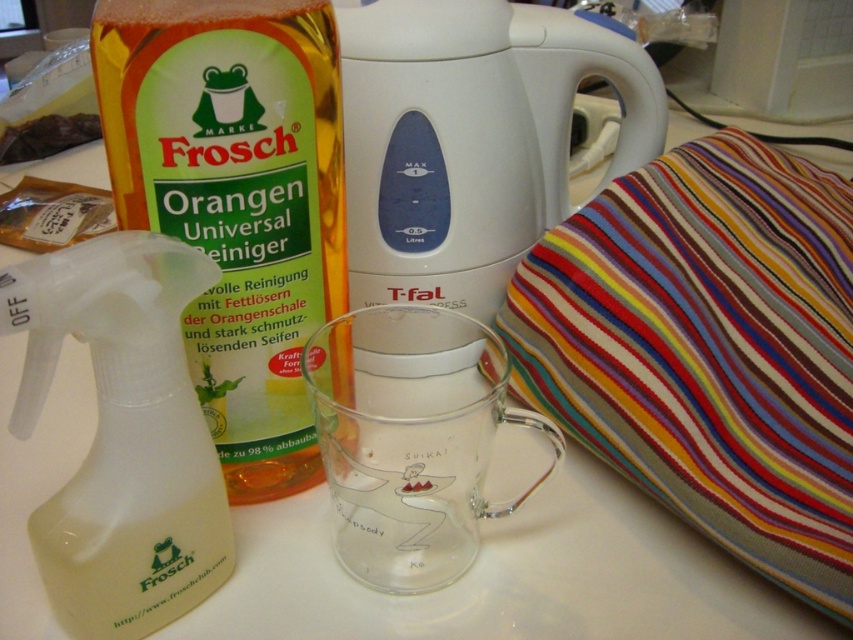
Based on the scene description, where is the striped fabric cushion at right located in terms of coordinates?

The striped fabric cushion at right is located at coordinates (708,349).

You are a robot arm trying to pick up the white plastic jug at center from the table. The robot arm can reach up to 16 inches. Can it reach the jug?

The white plastic jug at center is 16.82 inches away from the camera, which is beyond the robot arm reach of 16 inches. The robot arm cannot reach it.

You are a delivery robot that needs to place a package on the table. The package is 12 inches long. Can you fit the package between the striped fabric cushion at right and the edge of the table without overlapping anything?

The striped fabric cushion at right is 12.46 inches away from the camera. Since the package is 12 inches long, it should fit between the striped fabric cushion at right and the table edge as long as there is enough space along that dimension.